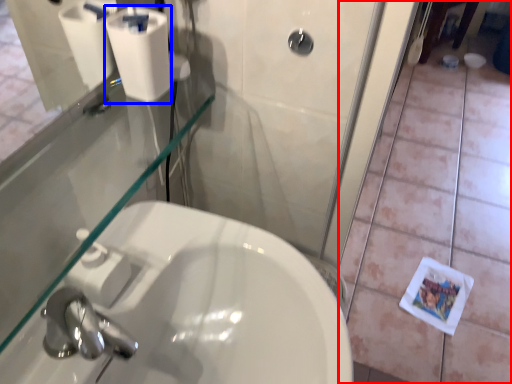
Question: Which of the following is the closest to the observer, tile (highlighted by a red box) or toilet paper (highlighted by a blue box)?

Choices:
 (A) tile
 (B) toilet paper

Answer: (B)